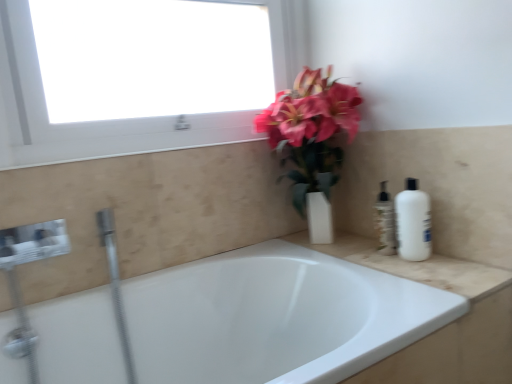
Question: Considering the relative positions of white glossy bathtub at center and white glossy window at upper left in the image provided, is white glossy bathtub at center to the left of white glossy window at upper left from the viewer's perspective?

Choices:
 (A) yes
 (B) no

Answer: (B)

Question: Does white glossy bathtub at center have a greater height compared to white glossy window at upper left?

Choices:
 (A) no
 (B) yes

Answer: (B)

Question: Is white glossy bathtub at center positioned beyond the bounds of white glossy window at upper left?

Choices:
 (A) yes
 (B) no

Answer: (A)

Question: Is white glossy bathtub at center aimed at white glossy window at upper left?

Choices:
 (A) yes
 (B) no

Answer: (B)

Question: Is white glossy bathtub at center placed right next to white glossy window at upper left?

Choices:
 (A) yes
 (B) no

Answer: (B)

Question: Is white glossy bathtub at center smaller than white glossy window at upper left?

Choices:
 (A) no
 (B) yes

Answer: (A)

Question: Can we say white glossy window at upper left lies outside matte white vase at upper center?

Choices:
 (A) yes
 (B) no

Answer: (A)

Question: From a real-world perspective, is white glossy window at upper left physically above matte white vase at upper center?

Choices:
 (A) yes
 (B) no

Answer: (A)

Question: Considering the relative sizes of white glossy window at upper left and matte white vase at upper center in the image provided, is white glossy window at upper left shorter than matte white vase at upper center?

Choices:
 (A) no
 (B) yes

Answer: (B)

Question: Is white glossy window at upper left positioned with its back to matte white vase at upper center?

Choices:
 (A) no
 (B) yes

Answer: (A)

Question: Is white glossy window at upper left aimed at matte white vase at upper center?

Choices:
 (A) yes
 (B) no

Answer: (B)

Question: Does white glossy window at upper left appear on the right side of matte white vase at upper center?

Choices:
 (A) yes
 (B) no

Answer: (B)

Question: Could you tell me if white matte bottle at right is facing white glossy window at upper left?

Choices:
 (A) yes
 (B) no

Answer: (B)